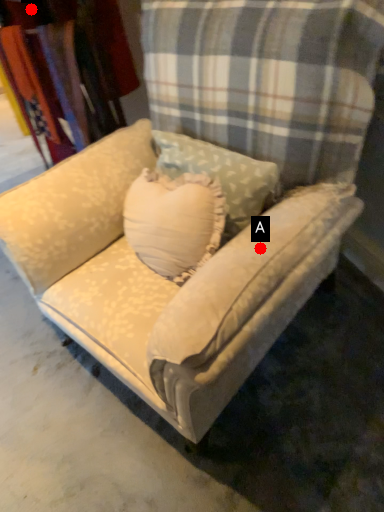
Question: Two points are circled on the image, labeled by A and B beside each circle. Which of the following is the closest to the observer?

Choices:
 (A) A is closer
 (B) B is closer

Answer: (A)